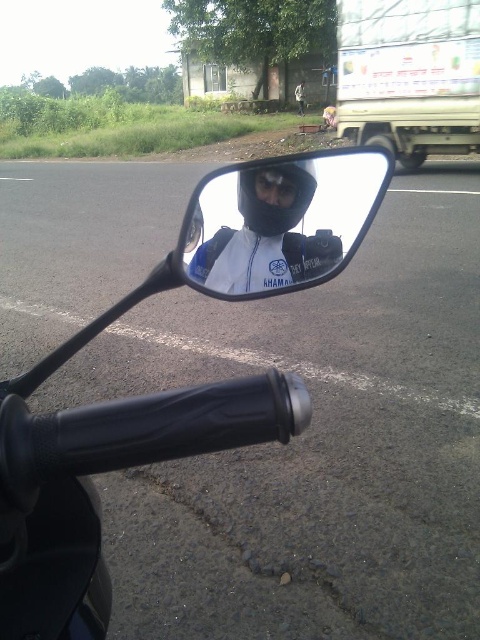
You are a rider checking the distance between the black matte motorcycle handlebar at center and the matte black mirror at center for a safety inspection. According to the manufacturer guidelines, the minimum safe distance between these two parts should be 4.5 inches. Is the current distance compliant with the safety standards?

The black matte motorcycle handlebar at center is 4.60 inches away from the matte black mirror at center, which exceeds the minimum required distance of 4.5 inches. Therefore, the current distance is compliant with the safety standards.

From the picture: You are riding a motorcycle and want to adjust your side mirror. Which object, the black matte motorcycle handlebar at center or the matte black mirror at center, is closer to your hand when reaching forward?

The black matte motorcycle handlebar at center is closer to the viewer than the matte black mirror at center, so the handlebar is closer to your hand when reaching forward.

You are riding a motorcycle and need to adjust your side mirror. Given the black matte motorcycle handlebar at center and the matte black mirror at center, which object is positioned higher relative to the other?

The black matte motorcycle handlebar at center is much taller than the matte black mirror at center, so the handlebar is positioned higher.